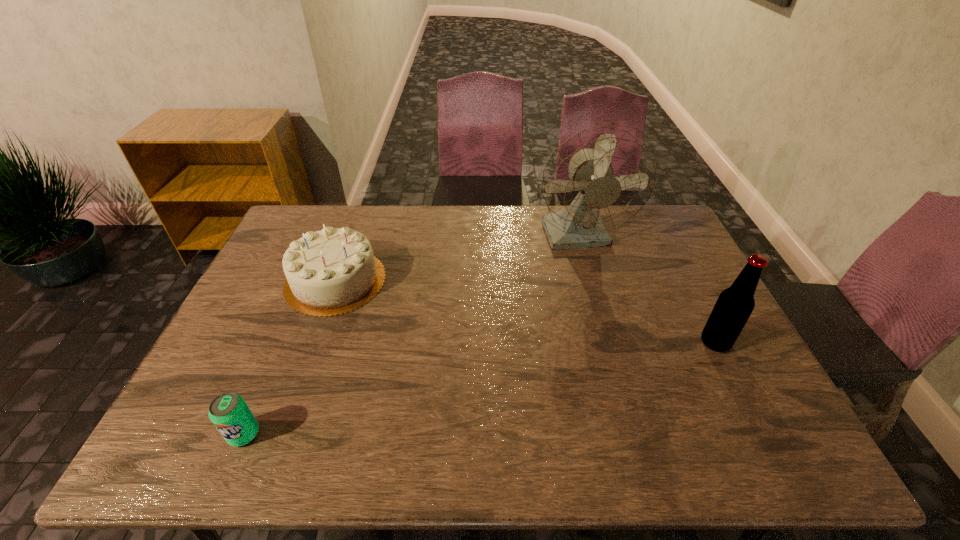
Select which object is the third closest to the second shortest object. Please provide its 2D coordinates. Your answer should be formatted as a tuple, i.e. [(x, y)], where the tuple contains the x and y coordinates of a point satisfying the conditions above.

[(735, 304)]

Point out which object is positioned as the third nearest to the third tallest object. Please provide its 2D coordinates. Your answer should be formatted as a tuple, i.e. [(x, y)], where the tuple contains the x and y coordinates of a point satisfying the conditions above.

[(735, 304)]